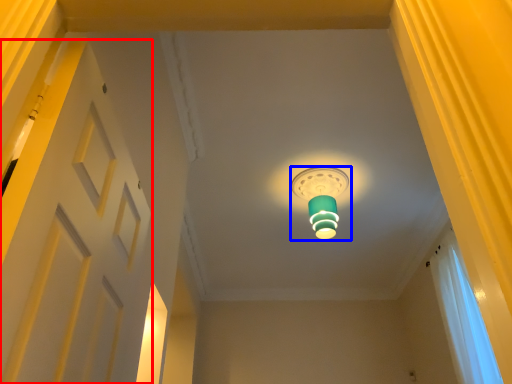
Question: Which object is closer to the camera taking this photo, door (highlighted by a red box) or lamp (highlighted by a blue box)?

Choices:
 (A) door
 (B) lamp

Answer: (A)